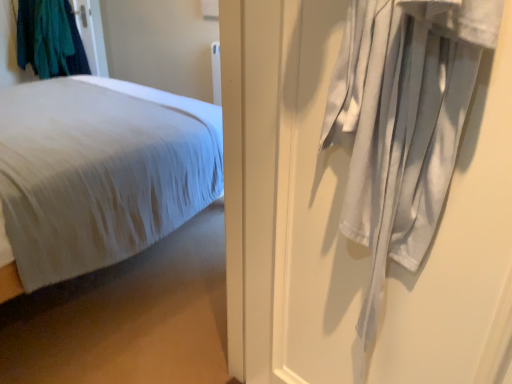
Question: Should I look upward or downward to see white soft bed at left?

Choices:
 (A) down
 (B) up

Answer: (B)

Question: From a real-world perspective, is teal fabric at upper left positioned under white soft bed at left based on gravity?

Choices:
 (A) no
 (B) yes

Answer: (A)

Question: Does teal fabric at upper left lie in front of white soft bed at left?

Choices:
 (A) no
 (B) yes

Answer: (A)

Question: From a real-world perspective, is teal fabric at upper left physically above white soft bed at left?

Choices:
 (A) no
 (B) yes

Answer: (B)

Question: Is teal fabric at upper left thinner than white soft bed at left?

Choices:
 (A) yes
 (B) no

Answer: (A)

Question: Can you confirm if teal fabric at upper left is positioned to the right of white soft bed at left?

Choices:
 (A) no
 (B) yes

Answer: (A)

Question: From the image's perspective, is teal fabric at upper left on white soft bed at left?

Choices:
 (A) no
 (B) yes

Answer: (B)

Question: Can you confirm if white cotton curtain at right is taller than white soft bed at left?

Choices:
 (A) yes
 (B) no

Answer: (A)

Question: Is white cotton curtain at right bigger than white soft bed at left?

Choices:
 (A) no
 (B) yes

Answer: (A)

Question: Considering the relative positions of white cotton curtain at right and white soft bed at left in the image provided, is white cotton curtain at right to the left of white soft bed at left from the viewer's perspective?

Choices:
 (A) no
 (B) yes

Answer: (A)

Question: Is white cotton curtain at right wider than white soft bed at left?

Choices:
 (A) yes
 (B) no

Answer: (B)

Question: Is white cotton curtain at right located outside white soft bed at left?

Choices:
 (A) no
 (B) yes

Answer: (B)

Question: From a real-world perspective, is white cotton curtain at right on top of white soft bed at left?

Choices:
 (A) no
 (B) yes

Answer: (B)

Question: Considering the relative sizes of white cotton curtain at right and teal fabric at upper left in the image provided, is white cotton curtain at right taller than teal fabric at upper left?

Choices:
 (A) no
 (B) yes

Answer: (B)